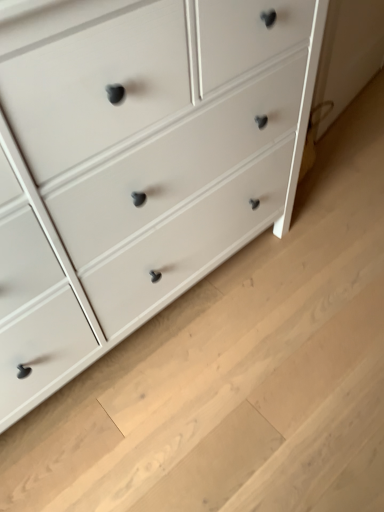
This screenshot has height=512, width=384. In order to click on space that is in front of white painted wood chest of drawers at center in this screenshot , I will do `click(188, 428)`.